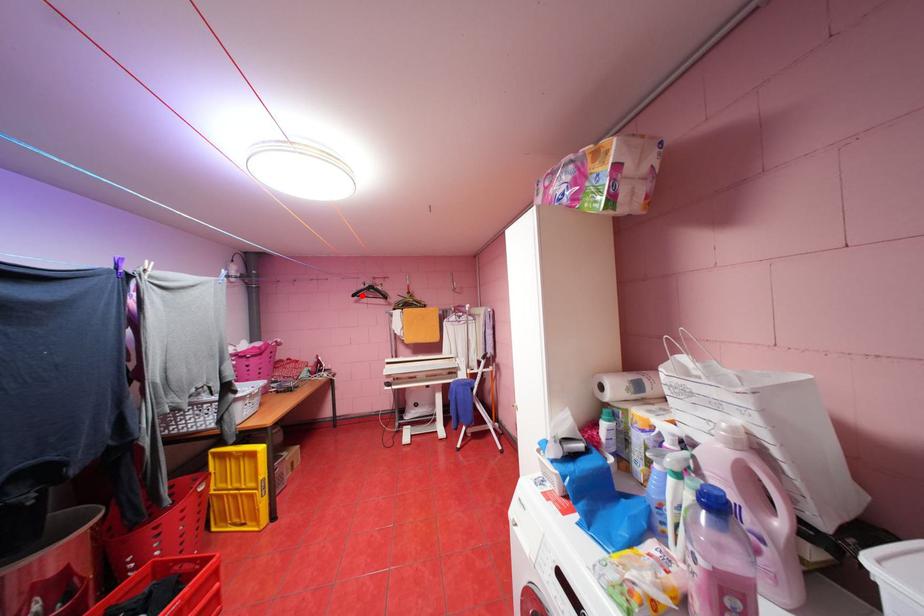
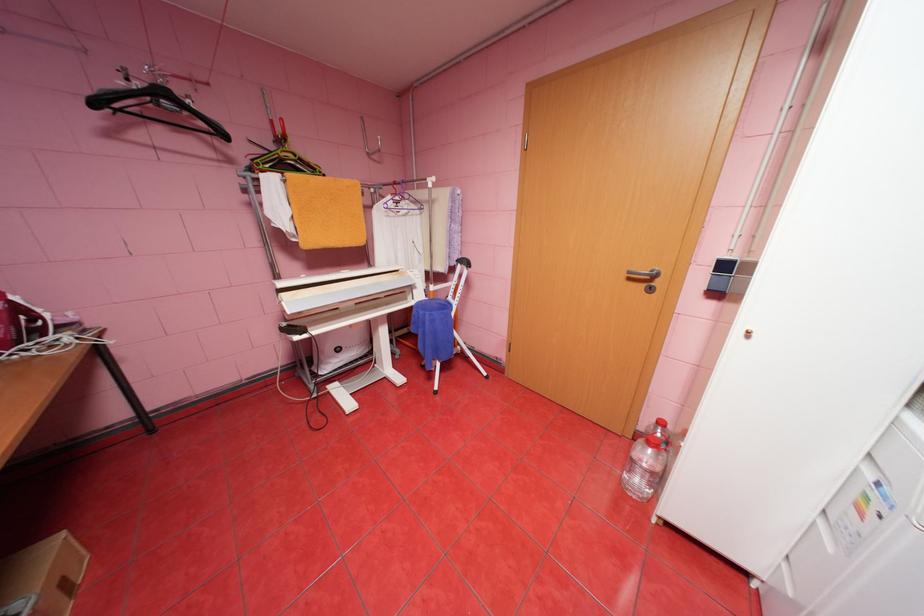
Question: I am providing you with two images of the same scene from different viewpoints. Given a red point in image1, look at the same physical point in image2. Is it:

Choices:
 (A) Closer to the viewpoint
 (B) Farther from the viewpoint

Answer: (B)